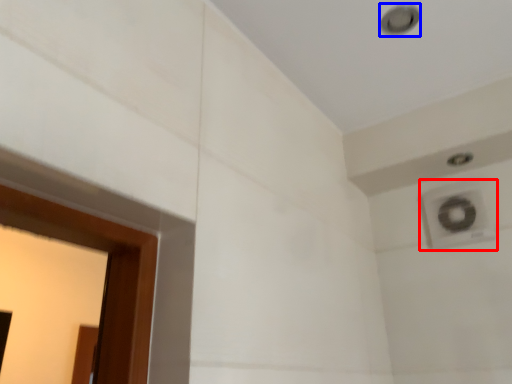
Question: Which object appears farthest to the camera in this image, air conditioning (highlighted by a red box) or hole (highlighted by a blue box)?

Choices:
 (A) air conditioning
 (B) hole

Answer: (A)